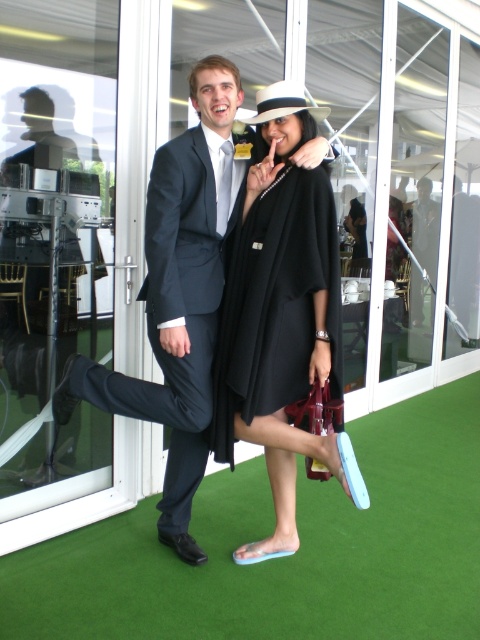
You are standing at the origin point of the coordinate system. You want to move towards the matte black suit at center. What are the coordinates you need to move to reach it?

The coordinates to reach the matte black suit at center are at point 0.463 in the x direction and 0.373 in the y direction.

You are a photographer at a formal event and need to adjust the camera focus. The dark blue wool suit at center and the black matte dress at center are both in the frame. Based on their distance, which one is closer to the camera?

The dark blue wool suit at center is 8.06 inches closer to the camera than the black matte dress at center, so the dark blue wool suit at center is closer.

In the image, there are two people standing together. The person on the left is wearing a dark blue wool suit at center, and the person on the right is wearing a black matte dress at center. Which clothing item is positioned to the left of the other?

The dark blue wool suit at center is to the left of the black matte dress at center.